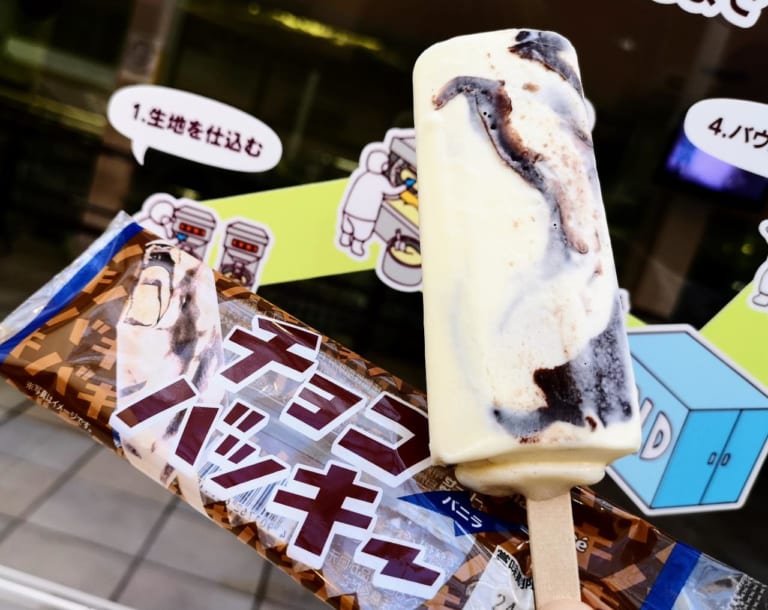
The image size is (768, 610). What are the coordinates of `blue doors` in the screenshot? It's located at (706, 434), (743, 435).